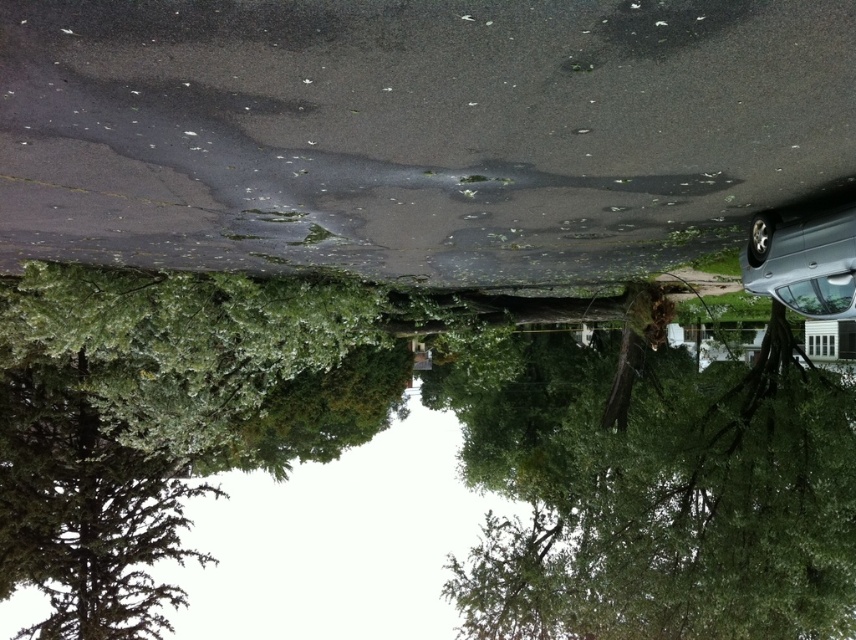
Who is higher up, green leafy tree at center or green leafy tree at left?

green leafy tree at left is higher up.

Find the location of a particular element. green leafy tree at center is located at coordinates (676, 508).

Does green leafy tree at center come in front of silver metallic car at right?

No, green leafy tree at center is behind silver metallic car at right.

Is green leafy tree at center positioned at the back of silver metallic car at right?

That is True.

Does point (699, 422) lie in front of point (753, 244)?

No, (699, 422) is further to viewer.

Where is `green leafy tree at center`? green leafy tree at center is located at coordinates (676, 508).

Is point (230, 376) farther from camera compared to point (765, 252)?

Yes, point (230, 376) is farther from viewer.

At what (x,y) coordinates should I click in order to perform the action: click on green leafy tree at left. Please return your answer as a coordinate pair (x, y). Looking at the image, I should click on (140, 420).